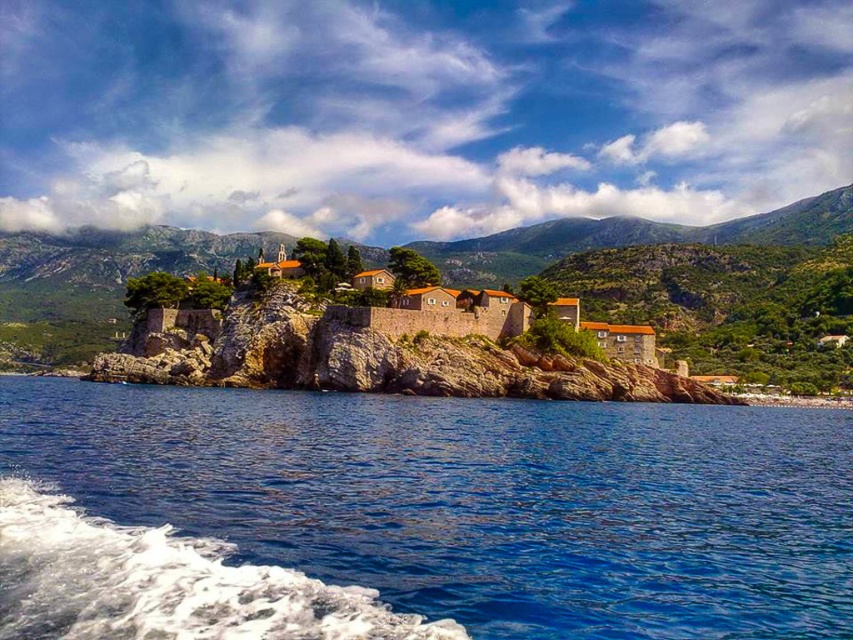
Question: Does blue liquid water at lower left have a greater width compared to brown stone mountain at center?

Choices:
 (A) no
 (B) yes

Answer: (A)

Question: Can you confirm if blue liquid water at lower left is smaller than brown stone mountain at center?

Choices:
 (A) no
 (B) yes

Answer: (B)

Question: Which of the following is the closest to the observer?

Choices:
 (A) (834, 358)
 (B) (65, 381)

Answer: (A)

Question: Is blue liquid water at lower left in front of brown stone mountain at center?

Choices:
 (A) yes
 (B) no

Answer: (A)